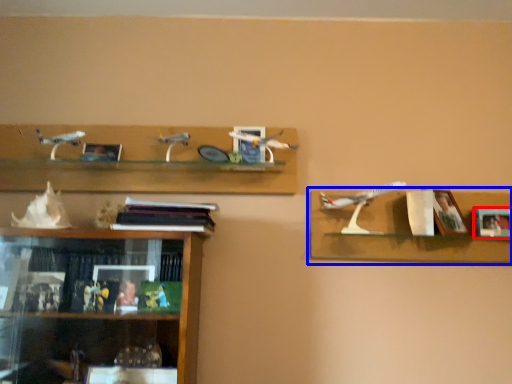
Question: Which point is closer to the camera, picture frame (highlighted by a red box) or shelf (highlighted by a blue box)?

Choices:
 (A) picture frame
 (B) shelf

Answer: (B)